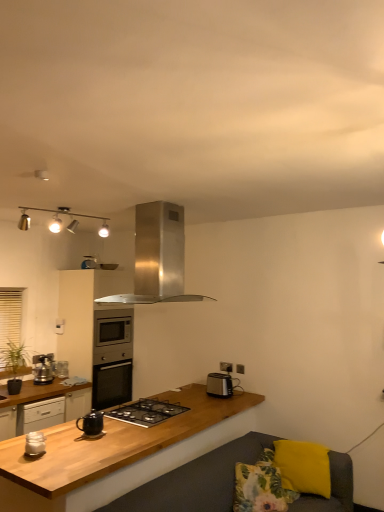
Identify the location of free space in front of black plastic toaster at right, marked as the second kitchen appliance in a bottom-to-top arrangement. Image resolution: width=384 pixels, height=512 pixels. (230, 400).